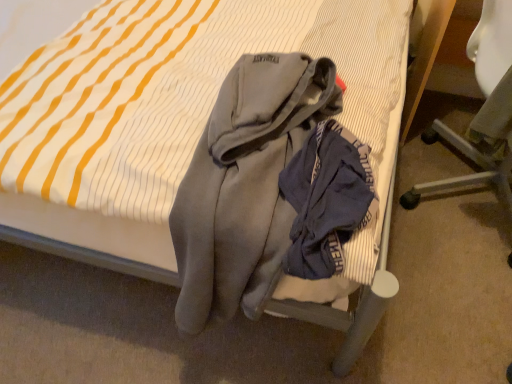
Question: Is gray fleece hoodie at center not close to white plastic chair at upper right?

Choices:
 (A) yes
 (B) no

Answer: (B)

Question: Does gray fleece hoodie at center have a larger size compared to white plastic chair at upper right?

Choices:
 (A) yes
 (B) no

Answer: (B)

Question: Is gray fleece hoodie at center wider than white plastic chair at upper right?

Choices:
 (A) no
 (B) yes

Answer: (B)

Question: Can you confirm if gray fleece hoodie at center is positioned to the right of white plastic chair at upper right?

Choices:
 (A) yes
 (B) no

Answer: (B)

Question: From a real-world perspective, is gray fleece hoodie at center below white plastic chair at upper right?

Choices:
 (A) yes
 (B) no

Answer: (B)

Question: Is gray fleece hoodie at center oriented towards white plastic chair at upper right?

Choices:
 (A) no
 (B) yes

Answer: (A)

Question: Is white plastic chair at upper right to the right of gray fleece hoodie at center from the viewer's perspective?

Choices:
 (A) no
 (B) yes

Answer: (B)

Question: Is white plastic chair at upper right thinner than gray fleece hoodie at center?

Choices:
 (A) yes
 (B) no

Answer: (A)

Question: Can you confirm if white plastic chair at upper right is taller than gray fleece hoodie at center?

Choices:
 (A) no
 (B) yes

Answer: (B)

Question: Would you consider white plastic chair at upper right to be distant from gray fleece hoodie at center?

Choices:
 (A) yes
 (B) no

Answer: (B)

Question: From the image's perspective, is white plastic chair at upper right on top of gray fleece hoodie at center?

Choices:
 (A) no
 (B) yes

Answer: (B)

Question: Does white plastic chair at upper right appear on the left side of gray fleece hoodie at center?

Choices:
 (A) no
 (B) yes

Answer: (A)

Question: In terms of width, does gray fleece hoodie at center look wider or thinner when compared to white plastic chair at upper right?

Choices:
 (A) thin
 (B) wide

Answer: (B)